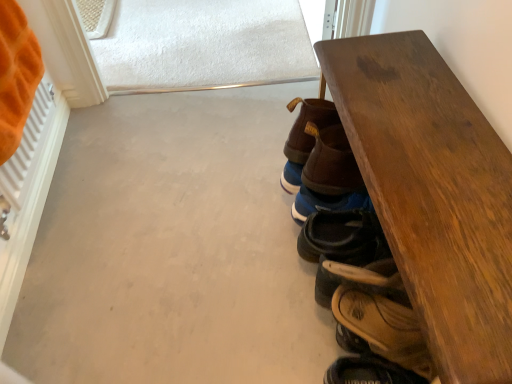
Find the location of a particular element. The image size is (512, 384). vacant area on top of brown leather sandal at lower right, which ranks as the 4th footwear in top-to-bottom order (from a real-world perspective) is located at coordinates (370, 289).